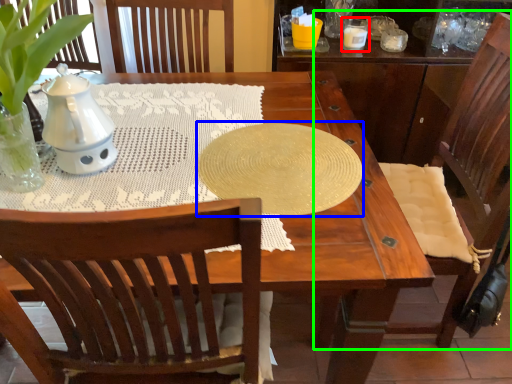
Question: Which object is positioned farthest from candle holder (highlighted by a red box)? Select from oval (highlighted by a blue box) and chair (highlighted by a green box).

Choices:
 (A) oval
 (B) chair

Answer: (A)